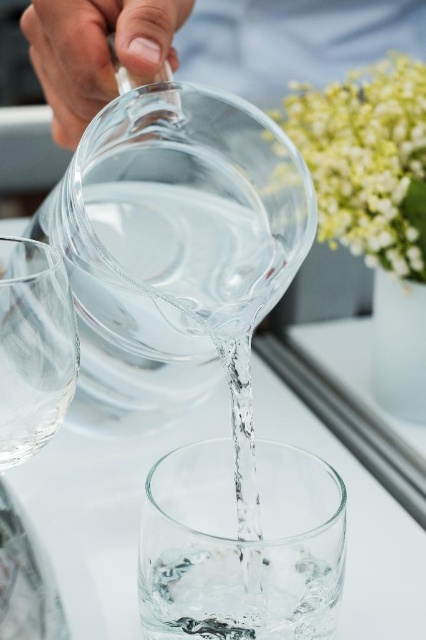
Question: Can you confirm if green leafy plant at upper right is positioned above transparent glass wine glass at left?

Choices:
 (A) no
 (B) yes

Answer: (B)

Question: Which object appears closest to the camera in this image?

Choices:
 (A) green leafy plant at upper right
 (B) transparent glass wine glass at left
 (C) clear glass pitcher at upper center

Answer: (B)

Question: Does clear glass pitcher at upper center have a smaller size compared to green leafy plant at upper right?

Choices:
 (A) no
 (B) yes

Answer: (A)

Question: Considering the real-world distances, which object is farthest from the transparent glass wine glass at left?

Choices:
 (A) clear glass pitcher at upper center
 (B) green leafy plant at upper right

Answer: (B)

Question: Which object is farther from the camera taking this photo?

Choices:
 (A) transparent glass wine glass at left
 (B) clear glass pitcher at upper center

Answer: (B)

Question: Is clear glass pitcher at upper center in front of transparent glass wine glass at left?

Choices:
 (A) no
 (B) yes

Answer: (A)